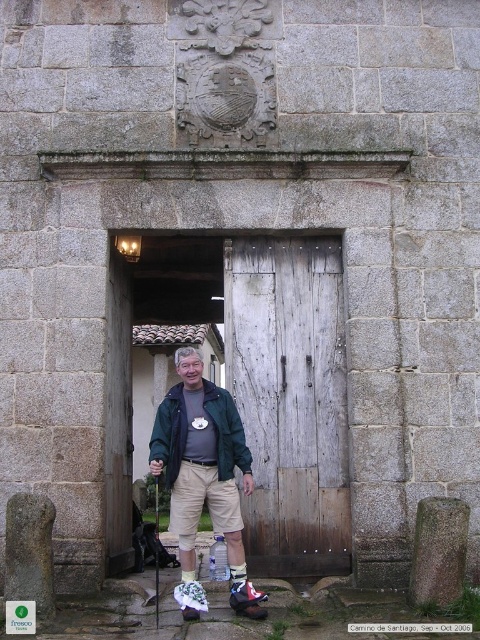
You are the man in the image. You need to reach the ornate stone emblem above the door to touch it. Considering the weathered wood door at center is above your green fabric jacket at center, can you reach the emblem without any assistance?

The weathered wood door at center is located above the green fabric jacket at center, but the exact height difference isn not specified. Without knowing how much higher the door is compared to your jacket, it is impossible to determine if you can reach the emblem without assistance.

You are a painter who needs to paint the weathered wood door at center and the green fabric jacket at center. If you want to paint both items with the same amount of paint per square meter, which item will require more paint in total?

The weathered wood door at center has a greater height compared to the green fabric jacket at center. Since the door is taller, it likely has a larger surface area, so it will require more paint.

You are standing in front of a historic stone wall with a weathered wooden door. You need to locate the exact position of the weathered wood door at center. What are its coordinates?

The weathered wood door at center is located at coordinates point (289, 400).